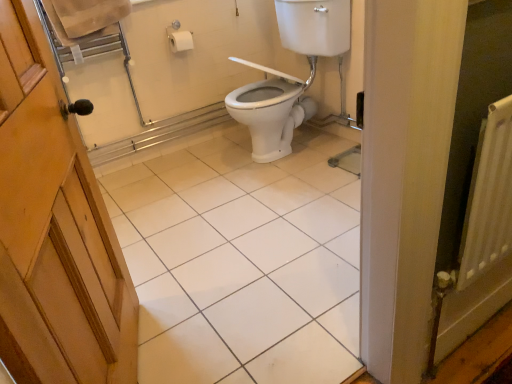
Identify the location of free space in front of white glossy toilet at center. (286, 198).